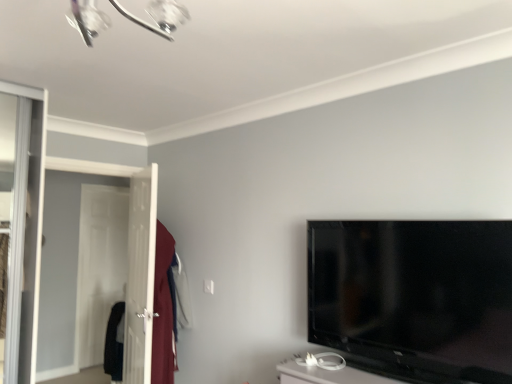
The width and height of the screenshot is (512, 384). I want to click on blank space situated above black glossy tv at right (from a real-world perspective), so click(x=393, y=227).